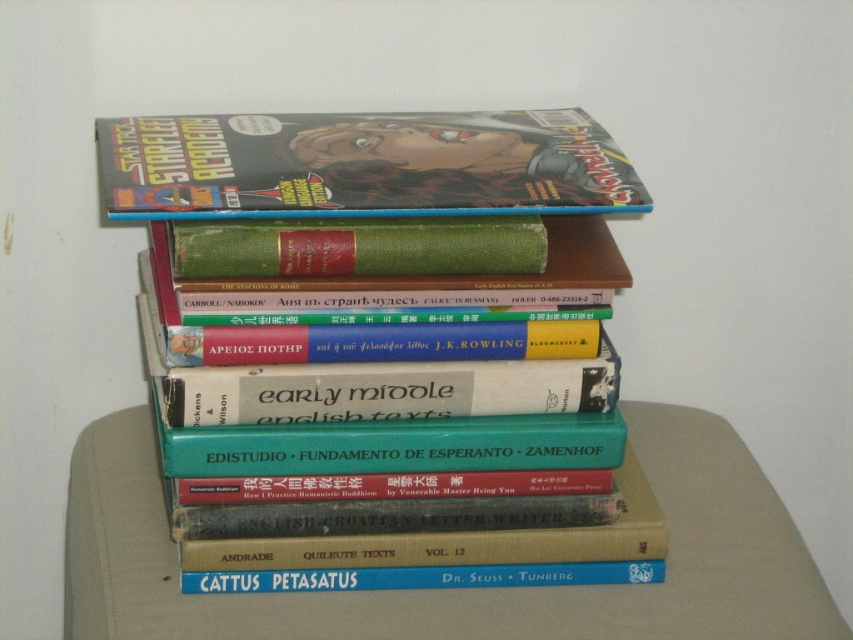
Can you confirm if smooth beige table at center is smaller than matte comic book at center?

No.

Based on the photo, is smooth beige table at center below matte comic book at center?

Yes.

This screenshot has height=640, width=853. Identify the location of smooth beige table at center. (462, 589).

Does hardcover book at center have a smaller size compared to smooth beige table at center?

Indeed, hardcover book at center has a smaller size compared to smooth beige table at center.

Who is higher up, hardcover book at center or smooth beige table at center?

hardcover book at center

Is point (187, 588) farther from camera compared to point (134, 528)?

No, it is in front of (134, 528).

What are the coordinates of `hardcover book at center` in the screenshot? It's located at (397, 472).

Between hardcover book at center and matte comic book at center, which one appears on the left side from the viewer's perspective?

matte comic book at center is more to the left.

Is point (396, 440) behind point (451, 131)?

No.

Find the location of `hardcover book at center`. hardcover book at center is located at coordinates click(x=397, y=472).